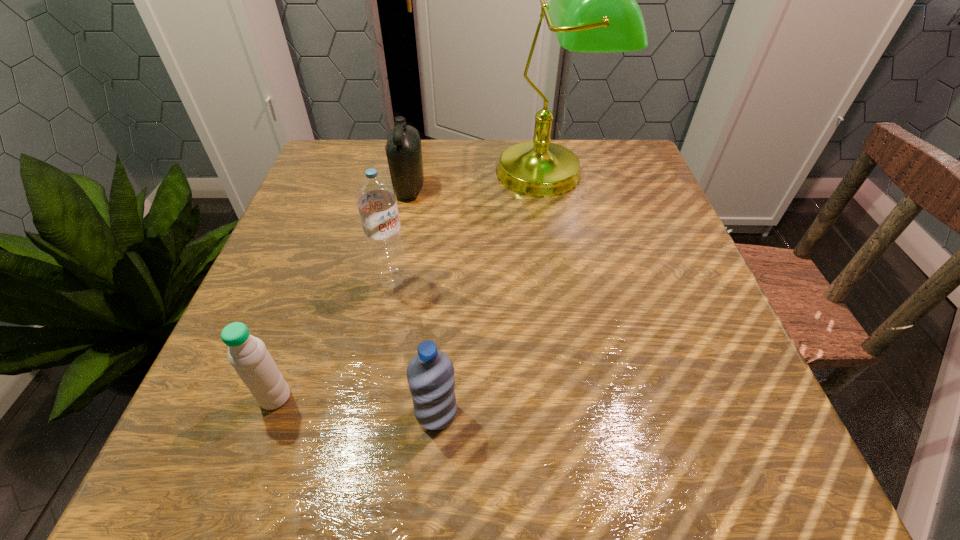
Image resolution: width=960 pixels, height=540 pixels. I want to click on vacant space at the far left corner of the desktop, so click(x=372, y=144).

Image resolution: width=960 pixels, height=540 pixels. I want to click on vacant space at the near left corner, so click(263, 442).

The image size is (960, 540). In the image, there is a desktop. Find the location of `vacant region at the far right corner`. vacant region at the far right corner is located at coordinates (591, 147).

In the image, there is a desktop. What are the coordinates of `vacant space at the near right corner` in the screenshot? It's located at (660, 429).

Where is `vacant area that lies between the rightmost object and the bottle`? The image size is (960, 540). vacant area that lies between the rightmost object and the bottle is located at coordinates (479, 181).

Where is `free space that is in between the rightmost water bottle and the tallest water bottle`? This screenshot has height=540, width=960. free space that is in between the rightmost water bottle and the tallest water bottle is located at coordinates (415, 346).

What are the coordinates of `unoccupied area between the bottle and the leftmost water bottle` in the screenshot? It's located at click(x=342, y=293).

Locate an element on the screen. This screenshot has height=540, width=960. empty space that is in between the leftmost water bottle and the lamp is located at coordinates (412, 285).

This screenshot has height=540, width=960. Find the location of `empty space that is in between the rightmost water bottle and the bottle`. empty space that is in between the rightmost water bottle and the bottle is located at coordinates (422, 301).

I want to click on free space between the leftmost water bottle and the second object from right to left, so pos(356,405).